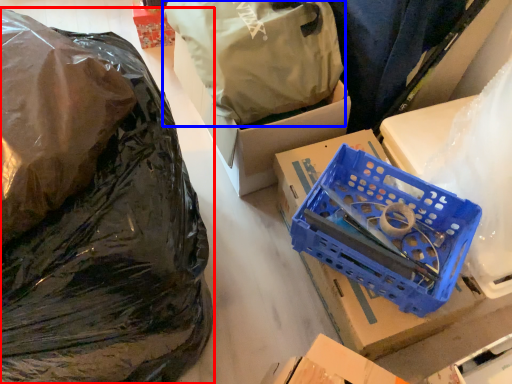
Question: Which object is closer to the camera taking this photo, plastic bag (highlighted by a red box) or plastic bag (highlighted by a blue box)?

Choices:
 (A) plastic bag
 (B) plastic bag

Answer: (A)